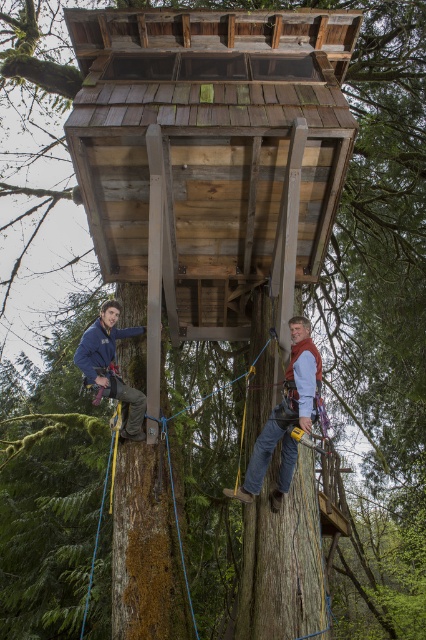
You are standing on the ground looking up at the wooden platform at center and the denim jeans at center. Which object is higher from the ground?

The wooden platform at center is taller than denim jeans at center, so the wooden platform at center is higher from the ground.

You are standing at the base of the tree looking up at the two points marked in the image. Which point, point (149, 188) or point (112, 369), is closer to you?

Point (149, 188) is in front of point (112, 369), so it is closer to you.